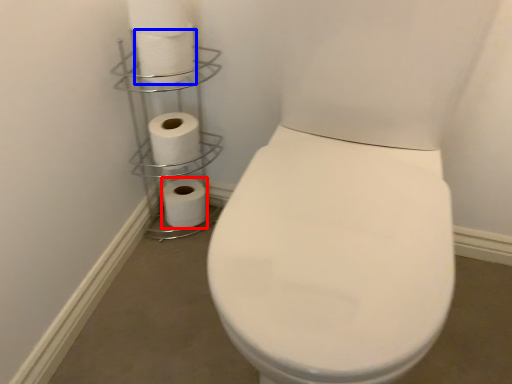
Question: Which point is further to the camera, toilet paper (highlighted by a red box) or toilet paper (highlighted by a blue box)?

Choices:
 (A) toilet paper
 (B) toilet paper

Answer: (A)